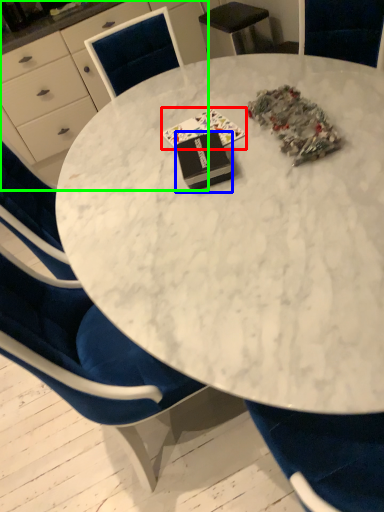
Question: Estimate the real-world distances between objects in this image. Which object is closer to book (highlighted by a red box), book (highlighted by a blue box) or desk (highlighted by a green box)?

Choices:
 (A) book
 (B) desk

Answer: (A)